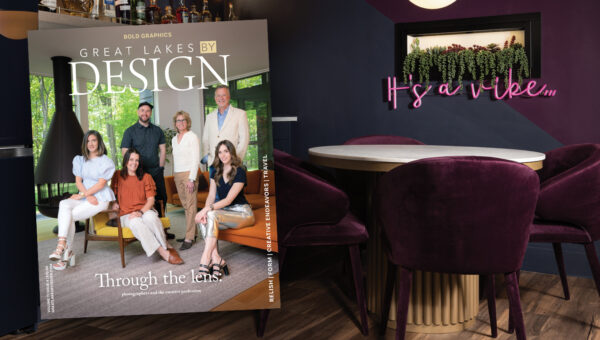
Where is `white table top`? The image size is (600, 340). white table top is located at coordinates (393, 153).